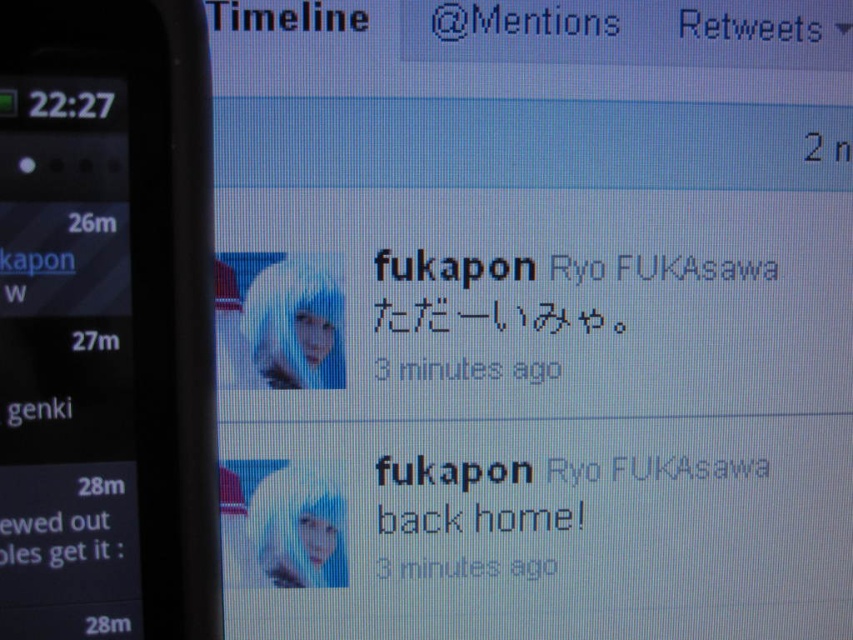
You are trying to read the content of the black matte text at center and the black plastic smartphone at left on the computer screen. Which one is located below the other?

The black matte text at center is positioned under the black plastic smartphone at left, meaning the text is below the smartphone on the screen.